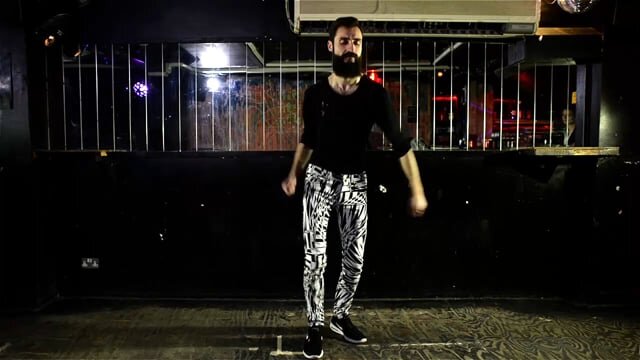
Identify the location of woodgrain style old flooring. The image size is (640, 360). (198, 318), (444, 335), (555, 332).